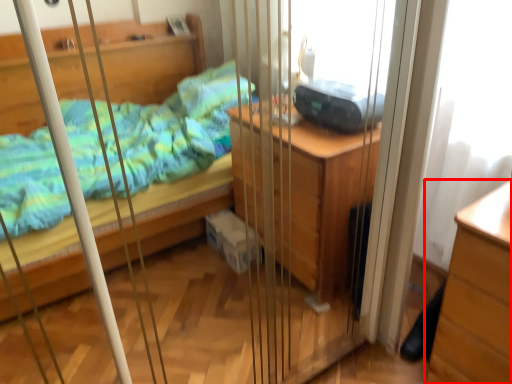
Question: In this image, where is chest of drawers (annotated by the red box) located relative to equipment?

Choices:
 (A) right
 (B) left

Answer: (A)